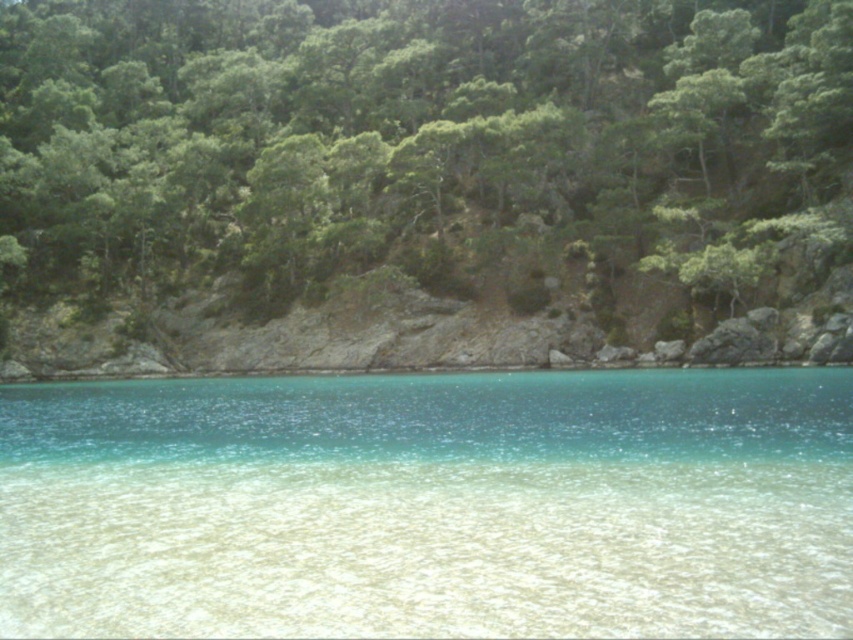
Question: Which point is farther to the camera?

Choices:
 (A) (426, 580)
 (B) (24, 83)

Answer: (B)

Question: Is green leafy trees at upper center to the right of clear sand at lower center from the viewer's perspective?

Choices:
 (A) yes
 (B) no

Answer: (B)

Question: Can you confirm if green leafy trees at upper center is smaller than clear sand at lower center?

Choices:
 (A) yes
 (B) no

Answer: (B)

Question: Does green leafy trees at upper center have a greater width compared to clear sand at lower center?

Choices:
 (A) no
 (B) yes

Answer: (B)